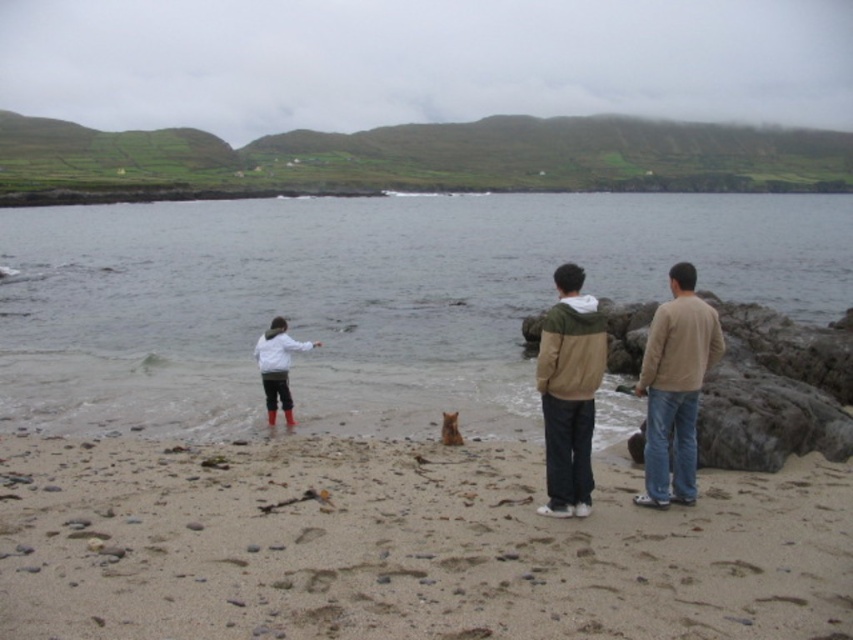
Question: Based on their relative distances, which object is nearer to the beige sweater at right?

Choices:
 (A) white matte jacket at lower left
 (B) smooth sand at lower center

Answer: (B)

Question: Does smooth sand at lower center appear under clear water at center?

Choices:
 (A) yes
 (B) no

Answer: (A)

Question: In this image, where is white matte jacket at lower left located relative to brown fur dog at center?

Choices:
 (A) left
 (B) right

Answer: (A)

Question: Is beige fleece jacket at center thinner than brown fur dog at center?

Choices:
 (A) yes
 (B) no

Answer: (B)

Question: Among these objects, which one is nearest to the camera?

Choices:
 (A) beige sweater at right
 (B) beige fleece jacket at center

Answer: (B)

Question: Which point appears farthest from the camera in this image?

Choices:
 (A) (247, 532)
 (B) (838, 296)
 (C) (277, 392)

Answer: (B)